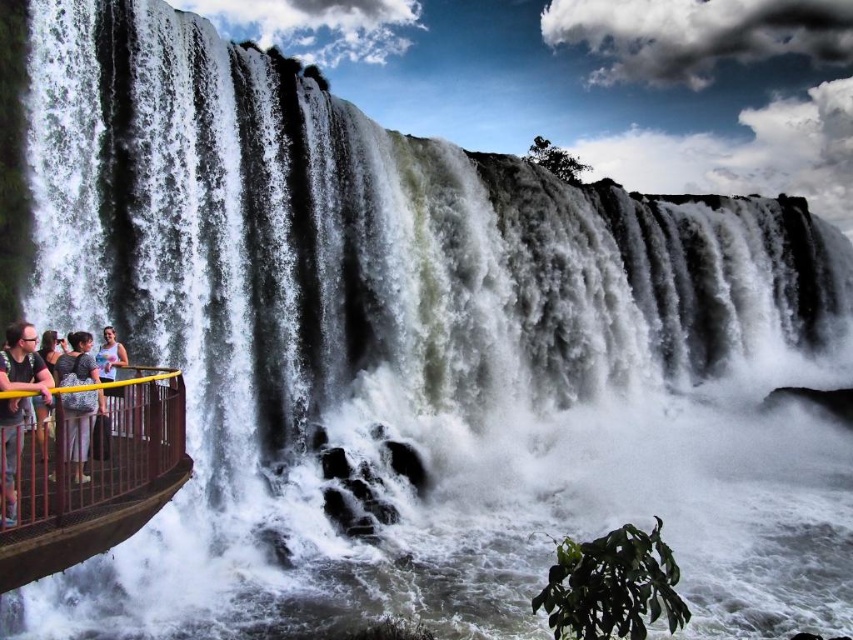
Is yellow metal railing at lower left to the right of matte white tank top at left from the viewer's perspective?

Yes, yellow metal railing at lower left is to the right of matte white tank top at left.

The width and height of the screenshot is (853, 640). In order to click on yellow metal railing at lower left in this screenshot , I will do `click(97, 477)`.

Can you confirm if matte black shirt at left is wider than matte gray shirt at left?

In fact, matte black shirt at left might be narrower than matte gray shirt at left.

Is matte black shirt at left smaller than matte gray shirt at left?

Correct, matte black shirt at left occupies less space than matte gray shirt at left.

Identify the location of matte black shirt at left. Image resolution: width=853 pixels, height=640 pixels. (22, 362).

Between matte gray shirt at left and matte white tank top at left, which one has more height?

matte gray shirt at left is taller.

Is matte gray shirt at left smaller than matte white tank top at left?

No, matte gray shirt at left is not smaller than matte white tank top at left.

Is point (44, 442) positioned behind point (113, 378)?

That is False.

At what (x,y) coordinates should I click in order to perform the action: click on matte gray shirt at left. Please return your answer as a coordinate pair (x, y). Looking at the image, I should click on (42, 426).